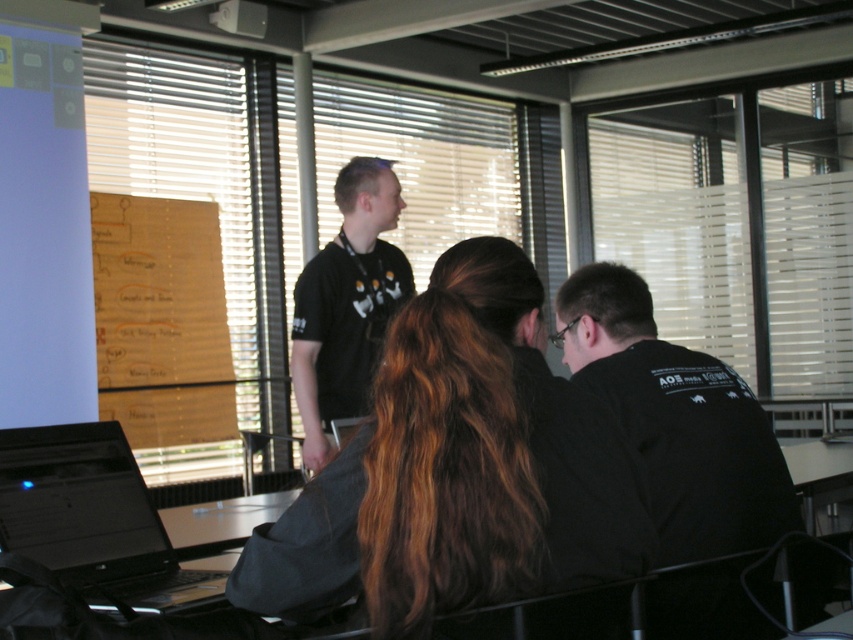
Based on the photo, you are a student in the classroom and need to write something on the wooden board at upper left. However, there is a white plastic projector at upper center in the way. Can you reach the board without moving the projector?

The wooden board at upper left is located below the white plastic projector at upper center, so you can still reach the board by writing below the projector without moving it.

You are standing in the classroom and want to write something on the wooden board at upper left. If your arm can reach up to 6 feet, can you reach the board?

The wooden board at upper left is 18.45 feet away from the viewer, which is farther than your arm can reach. You will need to move closer to reach it.